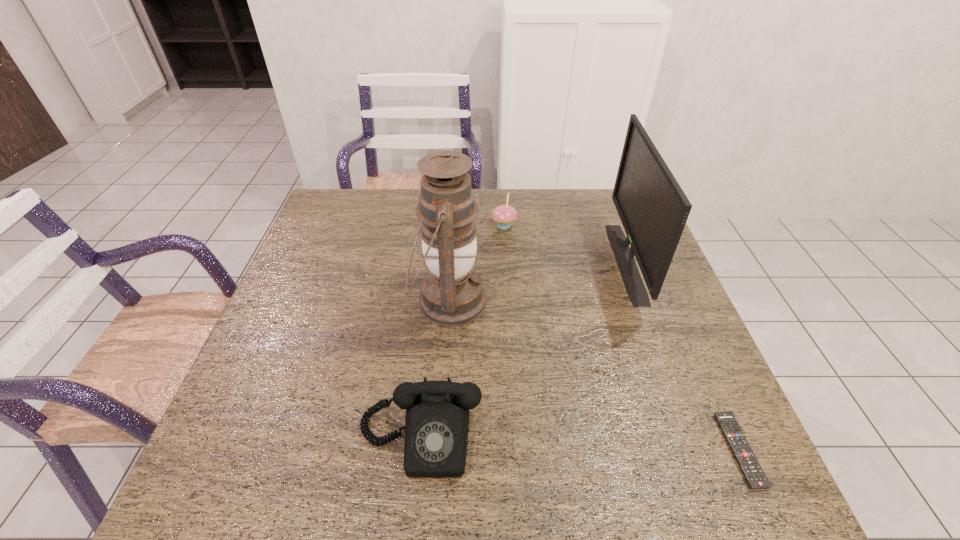
Identify the location of free space between the second object from right to left and the oil lamp. Image resolution: width=960 pixels, height=540 pixels. (x=538, y=281).

Identify the location of vacant area between the cupcake and the tallest object. click(476, 264).

The width and height of the screenshot is (960, 540). In order to click on free space between the rightmost object and the oil lamp in this screenshot , I will do `click(594, 375)`.

Image resolution: width=960 pixels, height=540 pixels. Find the location of `vacant space that is in between the fourth shortest object and the telephone`. vacant space that is in between the fourth shortest object and the telephone is located at coordinates (523, 350).

Locate an element on the screen. The height and width of the screenshot is (540, 960). free spot between the telephone and the cupcake is located at coordinates (462, 333).

At what (x,y) coordinates should I click in order to perform the action: click on unoccupied position between the oil lamp and the monitor. Please return your answer as a coordinate pair (x, y). Image resolution: width=960 pixels, height=540 pixels. Looking at the image, I should click on (538, 281).

Identify the location of object that is the third closest to the shortest object. The height and width of the screenshot is (540, 960). (452, 294).

Select which object is the closest to the tallest object. Please provide its 2D coordinates. Your answer should be formatted as a tuple, i.e. [(x, y)], where the tuple contains the x and y coordinates of a point satisfying the conditions above.

[(504, 215)]

Identify the location of free spot that satisfies the following two spatial constraints: 1. on the front-facing side of the monitor; 2. on the dial of the telephone. (691, 439).

I want to click on vacant space that satisfies the following two spatial constraints: 1. on the front-facing side of the monitor; 2. on the left side of the remote control, so click(695, 450).